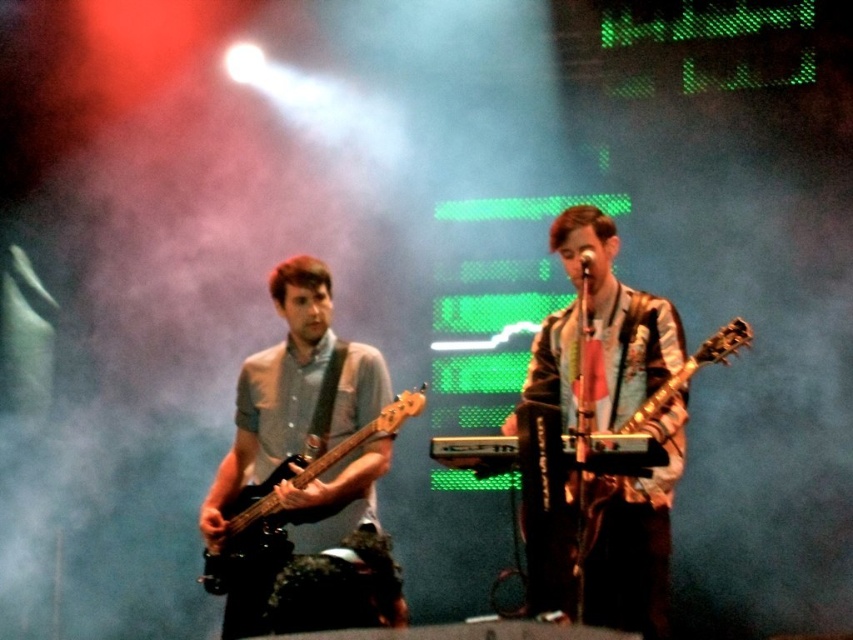
Question: Is shiny silver guitar at center smaller than matte black bass guitar at left?

Choices:
 (A) yes
 (B) no

Answer: (B)

Question: Is shiny silver guitar at center above matte black bass guitar at left?

Choices:
 (A) yes
 (B) no

Answer: (A)

Question: Which point is farther from the camera taking this photo?

Choices:
 (A) (634, 621)
 (B) (207, 573)

Answer: (B)

Question: Is shiny silver guitar at center thinner than matte black bass guitar at left?

Choices:
 (A) no
 (B) yes

Answer: (B)

Question: Among these points, which one is nearest to the camera?

Choices:
 (A) (247, 490)
 (B) (601, 481)

Answer: (B)